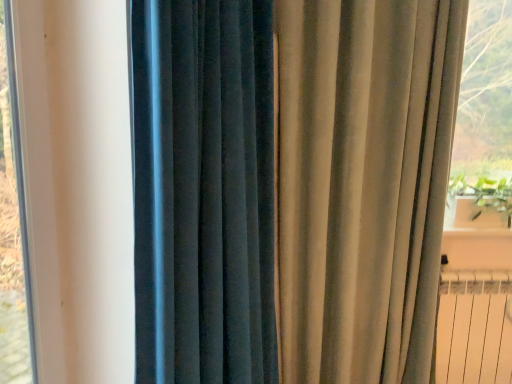
Question: Would you say green leafy plant at right is to the left or to the right of satin beige curtain at right, the 1th curtain viewed from the right, in the picture?

Choices:
 (A) left
 (B) right

Answer: (B)

Question: From their relative heights in the image, would you say green leafy plant at right is taller or shorter than satin beige curtain at right, the 1th curtain viewed from the right?

Choices:
 (A) tall
 (B) short

Answer: (B)

Question: Considering the real-world distances, which object is closest to the green leafy plant at right?

Choices:
 (A) satin beige curtain at right, the 1th curtain viewed from the right
 (B) velvet dark blue curtain at left, the second curtain from the right
 (C) white metallic radiator at lower right
 (D) white plastic window frame at left

Answer: (C)

Question: Which is nearer to the satin beige curtain at right, the 1th curtain viewed from the right?

Choices:
 (A) velvet dark blue curtain at left, which appears as the 1th curtain when viewed from the left
 (B) white metallic radiator at lower right
 (C) green leafy plant at right
 (D) white plastic window frame at left

Answer: (A)